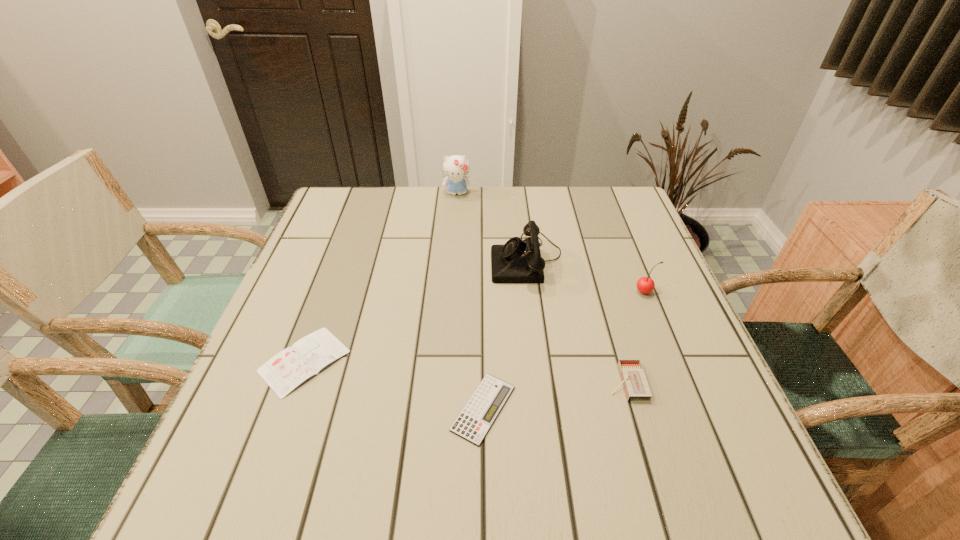
In the image, there is a desktop. Identify the location of free space at the near right corner. This screenshot has width=960, height=540. (737, 472).

The width and height of the screenshot is (960, 540). In order to click on empty space that is in between the fifth object from left to right and the calculator in this screenshot , I will do `click(555, 395)`.

Where is `empty space between the fourth shortest object and the leftmost object`? Image resolution: width=960 pixels, height=540 pixels. empty space between the fourth shortest object and the leftmost object is located at coordinates (475, 327).

Where is `free space between the rightmost object and the diary`? This screenshot has height=540, width=960. free space between the rightmost object and the diary is located at coordinates (475, 327).

Locate an element on the screen. This screenshot has width=960, height=540. empty space that is in between the tallest object and the fifth tallest object is located at coordinates (381, 277).

Identify the location of free area in between the calculator and the cherry. (564, 350).

Find the location of a particular element. This screenshot has width=960, height=540. vacant area between the shortest object and the matchbox is located at coordinates (555, 395).

You are a GUI agent. You are given a task and a screenshot of the screen. Output one action in this format:
    pyautogui.click(x=<x>, y=<y>)
    Task: Click on the free area in between the calculator and the telephone
    The height and width of the screenshot is (540, 960).
    Given the screenshot: What is the action you would take?
    pyautogui.click(x=505, y=333)

Locate an element on the screen. The height and width of the screenshot is (540, 960). vacant space in between the second shortest object and the calculator is located at coordinates (394, 384).

What are the coordinates of `free space between the rightmost object and the diary` in the screenshot? It's located at (475, 327).